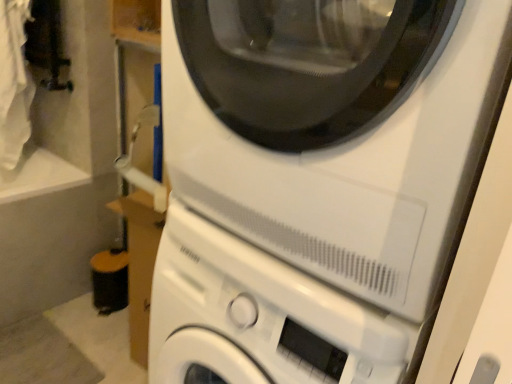
What do you see at coordinates (260, 316) in the screenshot?
I see `white matte washing machine at center, placed as the first washing machine when sorted from bottom to top` at bounding box center [260, 316].

Image resolution: width=512 pixels, height=384 pixels. Find the location of `white matte washing machine at center, placed as the first washing machine when sorted from bottom to top`. white matte washing machine at center, placed as the first washing machine when sorted from bottom to top is located at coordinates (260, 316).

In order to face white matte washing machine at center, placed as the first washing machine when sorted from bottom to top, should I rotate leftwards or rightwards?

A 4.656 degree turn to the right will do.

This screenshot has height=384, width=512. What do you see at coordinates (317, 182) in the screenshot?
I see `white matte washing machine at center, which is the 2th washing machine from bottom to top` at bounding box center [317, 182].

I want to click on white matte washing machine at center, which is the 2th washing machine from bottom to top, so click(317, 182).

This screenshot has height=384, width=512. Find the location of `white matte washing machine at center, placed as the first washing machine when sorted from bottom to top`. white matte washing machine at center, placed as the first washing machine when sorted from bottom to top is located at coordinates (260, 316).

Considering the positions of objects white matte washing machine at center, placed as the first washing machine when sorted from bottom to top, and white matte washing machine at center, which is the 2th washing machine from bottom to top, in the image provided, who is more to the right, white matte washing machine at center, placed as the first washing machine when sorted from bottom to top, or white matte washing machine at center, which is the 2th washing machine from bottom to top,?

white matte washing machine at center, which is the 2th washing machine from bottom to top, is more to the right.

Is white matte washing machine at center, placed as the first washing machine when sorted from bottom to top, further to the viewer compared to white matte washing machine at center, which is the 2th washing machine from bottom to top?

Yes, it is.

Between point (296, 297) and point (353, 310), which one is positioned in front?

Point (353, 310)

From the image's perspective, is white matte washing machine at center, placed as the first washing machine when sorted from bottom to top, above white matte washing machine at center, which is the 2th washing machine from bottom to top?

No, from the image's perspective, white matte washing machine at center, placed as the first washing machine when sorted from bottom to top, is not on top of white matte washing machine at center, which is the 2th washing machine from bottom to top.

From a real-world perspective, which is physically below, white matte washing machine at center, which is counted as the second washing machine, starting from the top, or white matte washing machine at center, the first washing machine viewed from the top?

From a 3D spatial view, white matte washing machine at center, which is counted as the second washing machine, starting from the top, is below.

Is white matte washing machine at center, which is counted as the second washing machine, starting from the top, wider than white matte washing machine at center, the first washing machine viewed from the top?

Yes, white matte washing machine at center, which is counted as the second washing machine, starting from the top, is wider than white matte washing machine at center, the first washing machine viewed from the top.

Who is taller, white matte washing machine at center, placed as the first washing machine when sorted from bottom to top, or white matte washing machine at center, which is the 2th washing machine from bottom to top?

white matte washing machine at center, placed as the first washing machine when sorted from bottom to top, is taller.

Looking at the image, does white matte washing machine at center, placed as the first washing machine when sorted from bottom to top, seem bigger or smaller compared to white matte washing machine at center, which is the 2th washing machine from bottom to top?

Clearly, white matte washing machine at center, placed as the first washing machine when sorted from bottom to top, is larger in size than white matte washing machine at center, which is the 2th washing machine from bottom to top.

Is white matte washing machine at center, which is counted as the second washing machine, starting from the top, spatially inside white matte washing machine at center, which is the 2th washing machine from bottom to top, or outside of it?

white matte washing machine at center, which is counted as the second washing machine, starting from the top, is spatially situated outside white matte washing machine at center, which is the 2th washing machine from bottom to top.

Are white matte washing machine at center, which is counted as the second washing machine, starting from the top, and white matte washing machine at center, the first washing machine viewed from the top, making contact?

Yes, white matte washing machine at center, which is counted as the second washing machine, starting from the top, is with white matte washing machine at center, the first washing machine viewed from the top.

Is white matte washing machine at center, which is counted as the second washing machine, starting from the top, turned away from white matte washing machine at center, which is the 2th washing machine from bottom to top?

white matte washing machine at center, which is counted as the second washing machine, starting from the top, is not turned away from white matte washing machine at center, which is the 2th washing machine from bottom to top.

How different are the orientations of white matte washing machine at center, placed as the first washing machine when sorted from bottom to top, and white matte washing machine at center, the first washing machine viewed from the top, in degrees?

There is a 0.92-degree angle between the facing directions of white matte washing machine at center, placed as the first washing machine when sorted from bottom to top, and white matte washing machine at center, the first washing machine viewed from the top.

Could you measure the distance between white matte washing machine at center, which is counted as the second washing machine, starting from the top, and white matte washing machine at center, which is the 2th washing machine from bottom to top?

white matte washing machine at center, which is counted as the second washing machine, starting from the top, is 3.25 inches away from white matte washing machine at center, which is the 2th washing machine from bottom to top.

Find the location of `washing machine in front of the white matte washing machine at center, placed as the first washing machine when sorted from bottom to top`. washing machine in front of the white matte washing machine at center, placed as the first washing machine when sorted from bottom to top is located at coordinates (317, 182).

Does white matte washing machine at center, the first washing machine viewed from the top, appear on the right side of white matte washing machine at center, which is counted as the second washing machine, starting from the top?

Indeed, white matte washing machine at center, the first washing machine viewed from the top, is positioned on the right side of white matte washing machine at center, which is counted as the second washing machine, starting from the top.

Which object is closer to the camera taking this photo, white matte washing machine at center, the first washing machine viewed from the top, or white matte washing machine at center, placed as the first washing machine when sorted from bottom to top?

white matte washing machine at center, the first washing machine viewed from the top, is closer to the camera.

Considering the points (349, 5) and (300, 248), which point is behind, point (349, 5) or point (300, 248)?

The point (349, 5) is more distant.

From the image's perspective, between white matte washing machine at center, which is the 2th washing machine from bottom to top, and white matte washing machine at center, which is counted as the second washing machine, starting from the top, which one is located above?

white matte washing machine at center, which is the 2th washing machine from bottom to top.

From a real-world perspective, which object stands above the other?

white matte washing machine at center, the first washing machine viewed from the top.

Between white matte washing machine at center, the first washing machine viewed from the top, and white matte washing machine at center, placed as the first washing machine when sorted from bottom to top, which one has smaller width?

white matte washing machine at center, the first washing machine viewed from the top.

From the picture: Considering the sizes of objects white matte washing machine at center, which is the 2th washing machine from bottom to top, and white matte washing machine at center, which is counted as the second washing machine, starting from the top, in the image provided, who is taller, white matte washing machine at center, which is the 2th washing machine from bottom to top, or white matte washing machine at center, which is counted as the second washing machine, starting from the top,?

Standing taller between the two is white matte washing machine at center, which is counted as the second washing machine, starting from the top.

Between white matte washing machine at center, which is the 2th washing machine from bottom to top, and white matte washing machine at center, placed as the first washing machine when sorted from bottom to top, which one has larger size?

Bigger between the two is white matte washing machine at center, placed as the first washing machine when sorted from bottom to top.

In the scene shown: Can we say white matte washing machine at center, which is the 2th washing machine from bottom to top, lies outside white matte washing machine at center, placed as the first washing machine when sorted from bottom to top?

That's correct, white matte washing machine at center, which is the 2th washing machine from bottom to top, is outside of white matte washing machine at center, placed as the first washing machine when sorted from bottom to top.

Is white matte washing machine at center, which is the 2th washing machine from bottom to top, placed right next to white matte washing machine at center, placed as the first washing machine when sorted from bottom to top?

Yes, white matte washing machine at center, which is the 2th washing machine from bottom to top, is right next to white matte washing machine at center, placed as the first washing machine when sorted from bottom to top, and making contact.

Is white matte washing machine at center, the first washing machine viewed from the top, oriented away from white matte washing machine at center, which is counted as the second washing machine, starting from the top?

No, white matte washing machine at center, which is counted as the second washing machine, starting from the top, is not at the back of white matte washing machine at center, the first washing machine viewed from the top.

In the scene shown: How much distance is there between white matte washing machine at center, which is the 2th washing machine from bottom to top, and white matte washing machine at center, which is counted as the second washing machine, starting from the top?

white matte washing machine at center, which is the 2th washing machine from bottom to top, is 8.25 centimeters from white matte washing machine at center, which is counted as the second washing machine, starting from the top.

Locate an element on the screen. The width and height of the screenshot is (512, 384). washing machine behind the white matte washing machine at center, which is the 2th washing machine from bottom to top is located at coordinates (260, 316).

I want to click on washing machine that appears on the left of white matte washing machine at center, which is the 2th washing machine from bottom to top, so click(260, 316).

This screenshot has width=512, height=384. I want to click on washing machine above the white matte washing machine at center, which is counted as the second washing machine, starting from the top (from a real-world perspective), so click(x=317, y=182).